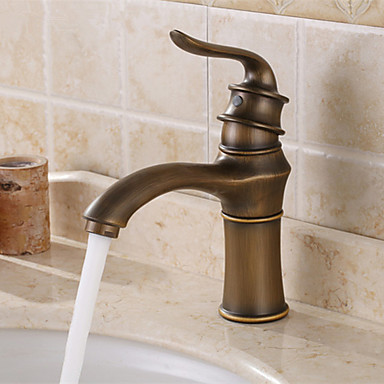
You are a GUI agent. You are given a task and a screenshot of the screen. Output one action in this format:
    pyautogui.click(x=<x>, y=<y>)
    Task: Click on the countertop
    
    Given the screenshot: What is the action you would take?
    pyautogui.click(x=313, y=336)